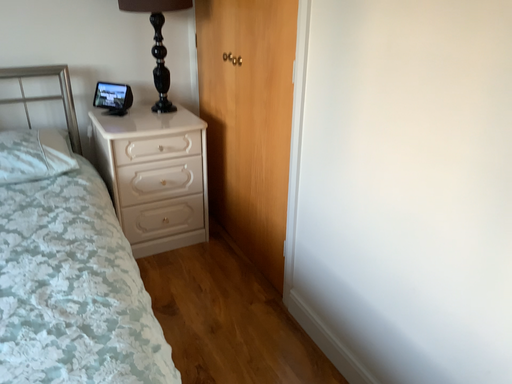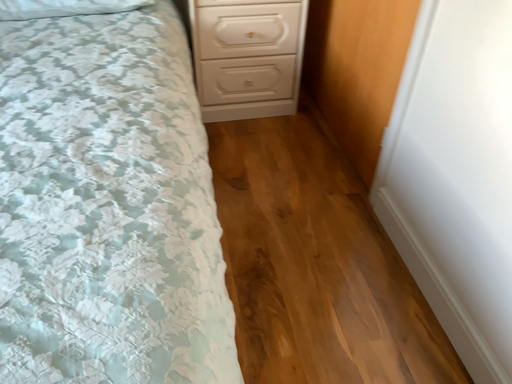
Question: Which way did the camera rotate in the video?

Choices:
 (A) rotated right
 (B) rotated left

Answer: (B)